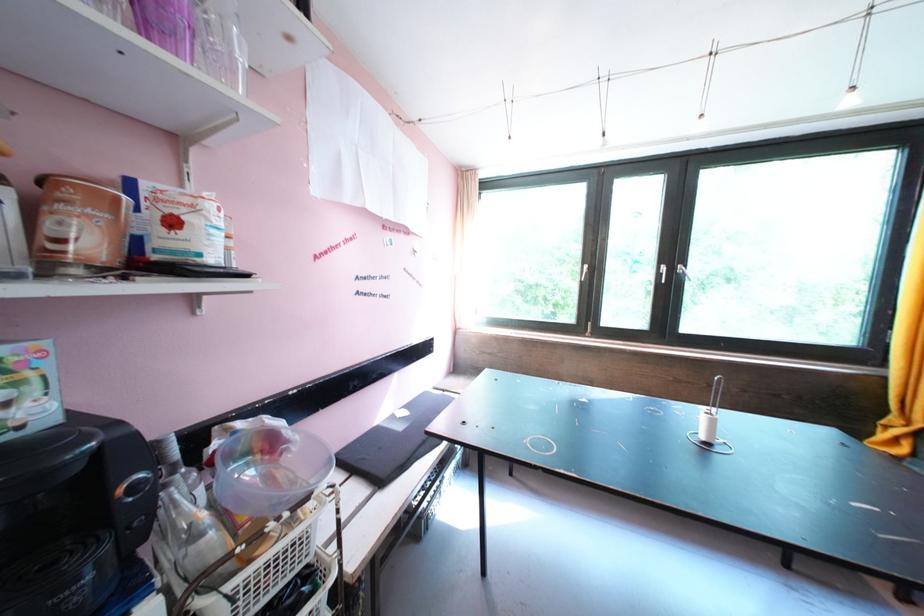
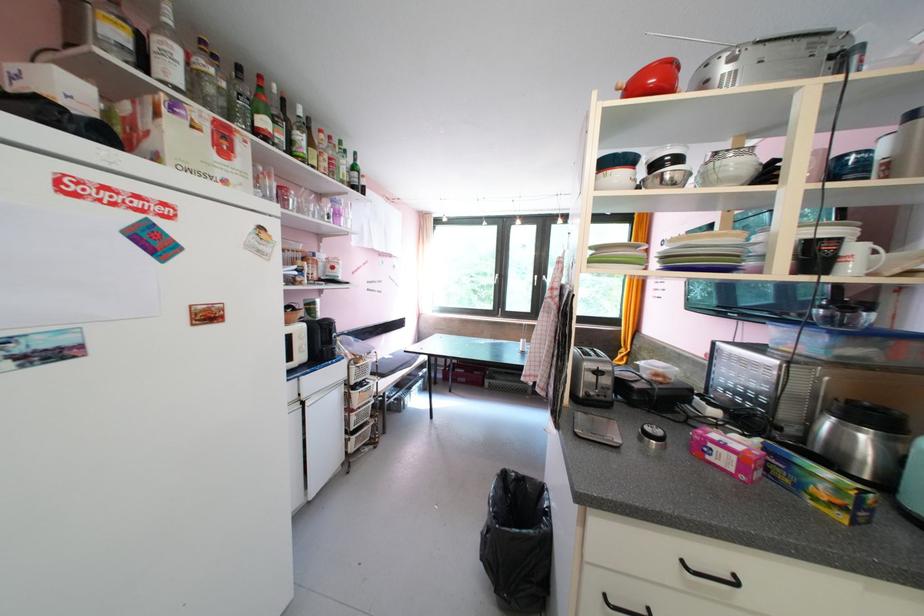
Question: I am providing you with two images of the same scene from different viewpoints. Which of the following objects are not visible in image2?

Choices:
 (A) silver window handle
 (B) pink cardboard box
 (C) wire storage basket
 (D) red pitcher

Answer: (A)